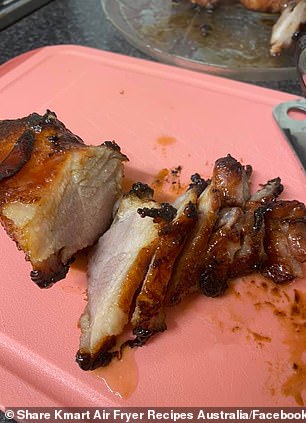
Where is `surface top`? surface top is located at coordinates (76, 29).